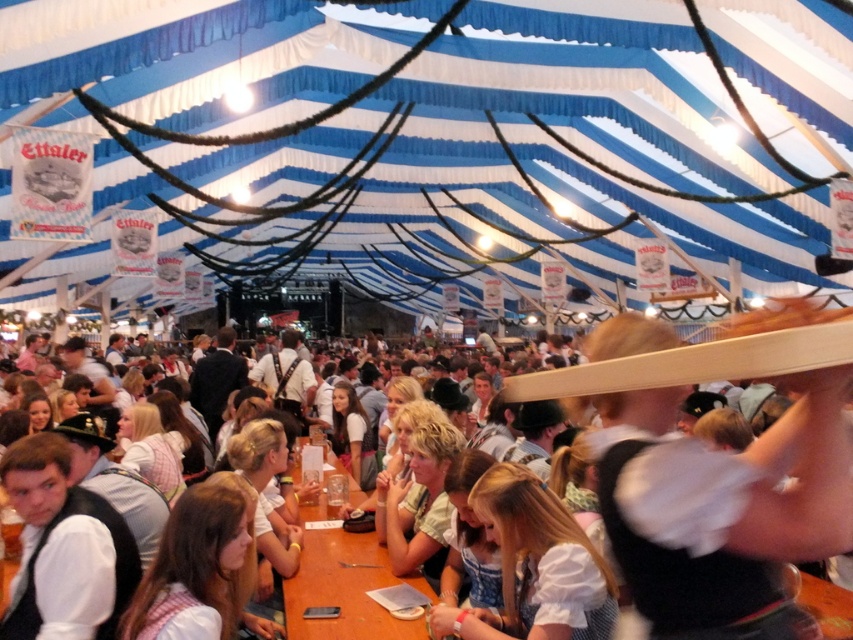
You are standing at the entrance of the tent and want to reach the point marked as point [758,552]. There is an obstacle at point [349,600]. Can you walk straight to your destination without going around the obstacle?

Yes, you can walk straight to point [758,552] because it is in front of point [349,600], meaning the obstacle is behind your path and won

You are a photographer standing at the entrance of the tent. You want to take a photo of the white cotton blouse at lower center and the brown wooden table at center. Which object is narrower?

The white cotton blouse at lower center is narrower than the brown wooden table at center.